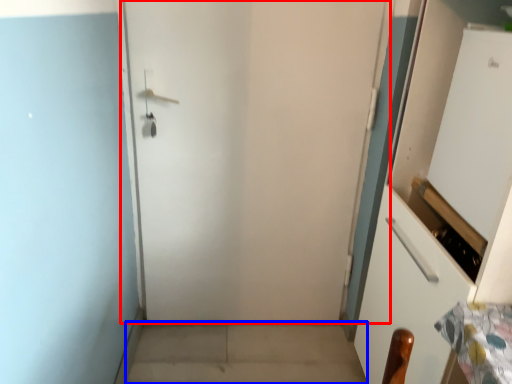
Question: Among these objects, which one is nearest to the camera, door (highlighted by a red box) or concrete (highlighted by a blue box)?

Choices:
 (A) door
 (B) concrete

Answer: (A)